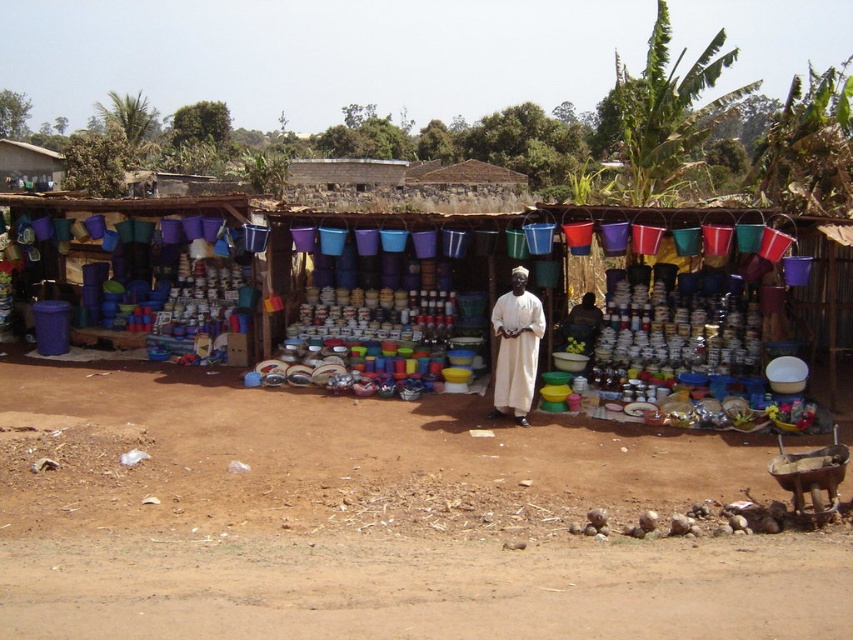
Which is in front, point (112, 397) or point (497, 320)?

Point (497, 320) is more forward.

Which is more to the right, brown dirt field at lower center or white cotton dress at center?

white cotton dress at center is more to the right.

What do you see at coordinates (375, 520) in the screenshot? I see `brown dirt field at lower center` at bounding box center [375, 520].

The height and width of the screenshot is (640, 853). In order to click on brown dirt field at lower center in this screenshot , I will do click(375, 520).

Does brown dirt field at lower center appear under multicolored plastic buckets at center?

Indeed, brown dirt field at lower center is positioned under multicolored plastic buckets at center.

Is brown dirt field at lower center wider than multicolored plastic buckets at center?

Incorrect, brown dirt field at lower center's width does not surpass multicolored plastic buckets at center's.

Find the location of a particular element. The height and width of the screenshot is (640, 853). brown dirt field at lower center is located at coordinates (375, 520).

Between multicolored plastic buckets at center and white cotton dress at center, which one is positioned lower?

white cotton dress at center

Consider the image. Is multicolored plastic buckets at center bigger than white cotton dress at center?

Yes, multicolored plastic buckets at center is bigger than white cotton dress at center.

Where is `multicolored plastic buckets at center`? Image resolution: width=853 pixels, height=640 pixels. multicolored plastic buckets at center is located at coordinates (292, 282).

Where is `multicolored plastic buckets at center`? The image size is (853, 640). multicolored plastic buckets at center is located at coordinates (292, 282).